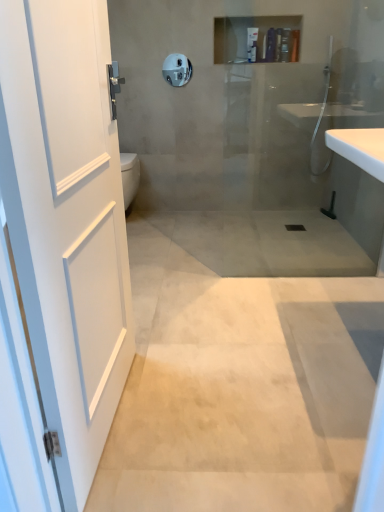
Question: Could satin nickel towel bar at upper center be considered to be inside matte plastic shampoo bottle at upper center, marked as the first toiletry in a right-to-left arrangement?

Choices:
 (A) yes
 (B) no

Answer: (B)

Question: From the image's perspective, is matte plastic shampoo bottle at upper center, which is the third toiletry from left to right, on satin nickel towel bar at upper center?

Choices:
 (A) no
 (B) yes

Answer: (B)

Question: Is matte plastic shampoo bottle at upper center, marked as the first toiletry in a right-to-left arrangement, further to the viewer compared to satin nickel towel bar at upper center?

Choices:
 (A) yes
 (B) no

Answer: (B)

Question: Can you confirm if matte plastic shampoo bottle at upper center, which is the third toiletry from left to right, is taller than satin nickel towel bar at upper center?

Choices:
 (A) yes
 (B) no

Answer: (B)

Question: Is matte plastic shampoo bottle at upper center, which is the third toiletry from left to right, positioned before satin nickel towel bar at upper center?

Choices:
 (A) no
 (B) yes

Answer: (B)

Question: Is beige polished concrete at center bigger or smaller than matte plastic shampoo bottle at upper center, marked as the first toiletry in a right-to-left arrangement?

Choices:
 (A) small
 (B) big

Answer: (B)

Question: Does point (327, 327) appear closer or farther from the camera than point (292, 31)?

Choices:
 (A) closer
 (B) farther

Answer: (A)

Question: Is beige polished concrete at center taller or shorter than matte plastic shampoo bottle at upper center, which is the third toiletry from left to right?

Choices:
 (A) tall
 (B) short

Answer: (B)

Question: From the image's perspective, is beige polished concrete at center located above or below matte plastic shampoo bottle at upper center, which is the third toiletry from left to right?

Choices:
 (A) above
 (B) below

Answer: (B)

Question: From the image's perspective, is white matte door at left located above or below beige polished concrete at center?

Choices:
 (A) above
 (B) below

Answer: (A)

Question: In the image, is white matte door at left positioned in front of or behind beige polished concrete at center?

Choices:
 (A) behind
 (B) front

Answer: (B)

Question: Would you say white matte door at left is to the left or to the right of beige polished concrete at center in the picture?

Choices:
 (A) left
 (B) right

Answer: (A)

Question: Based on their sizes in the image, would you say white matte door at left is bigger or smaller than beige polished concrete at center?

Choices:
 (A) small
 (B) big

Answer: (A)

Question: From the image's perspective, is matte plastic shampoo bottle at upper center, which is the third toiletry from left to right, positioned above or below matte plastic shampoo bottle at upper center, positioned as the second toiletry in left-to-right order?

Choices:
 (A) above
 (B) below

Answer: (A)

Question: From their relative heights in the image, would you say matte plastic shampoo bottle at upper center, which is the third toiletry from left to right, is taller or shorter than matte plastic shampoo bottle at upper center, which is the second toiletry from right to left?

Choices:
 (A) short
 (B) tall

Answer: (B)